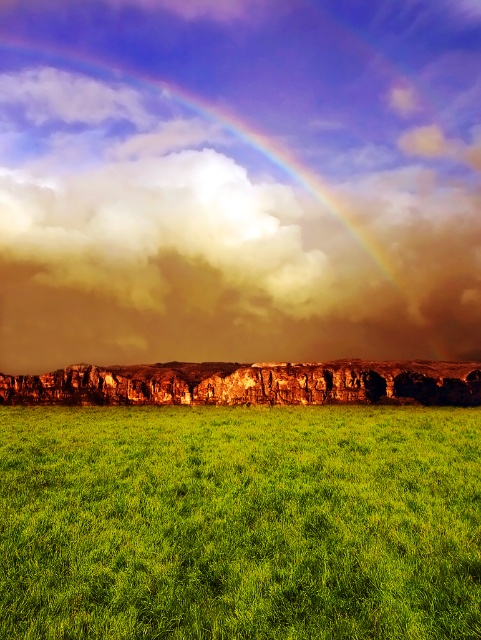
You are standing in the lush green field and want to walk from the point at coordinates point (42, 28) to the point at coordinates point (198, 541). Which direction should you face to walk towards the second point?

Since point (42, 28) is further to the camera than point (198, 541), you should face towards the direction of the cliff and the rainbow to walk towards point (198, 541).